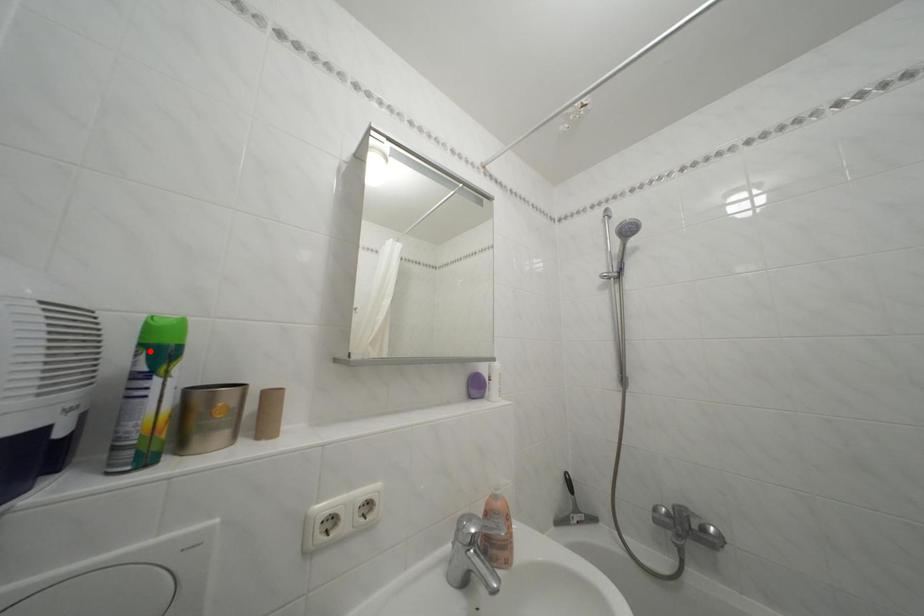
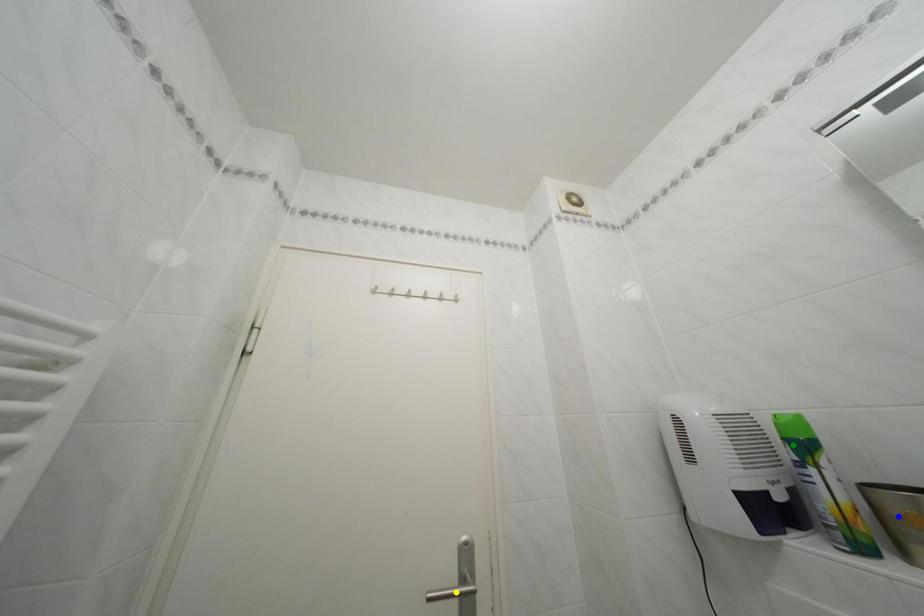
Question: I am providing you with two images of the same scene from different viewpoints. A red point is marked on the first image. You are given multiple points on the second image. Can you choose the point in image 2 that corresponds to the point in image 1?

Choices:
 (A) yellow point
 (B) blue point
 (C) green point

Answer: (C)